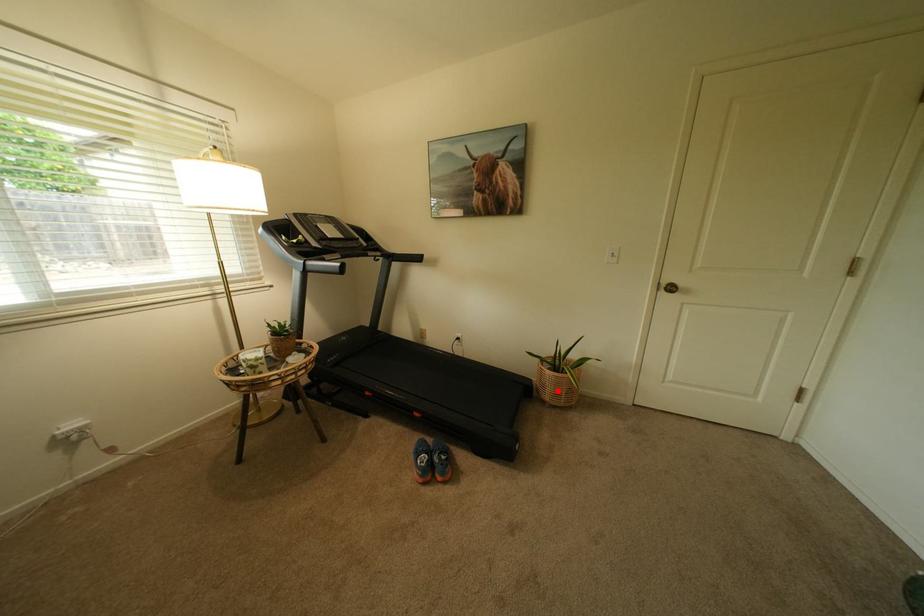
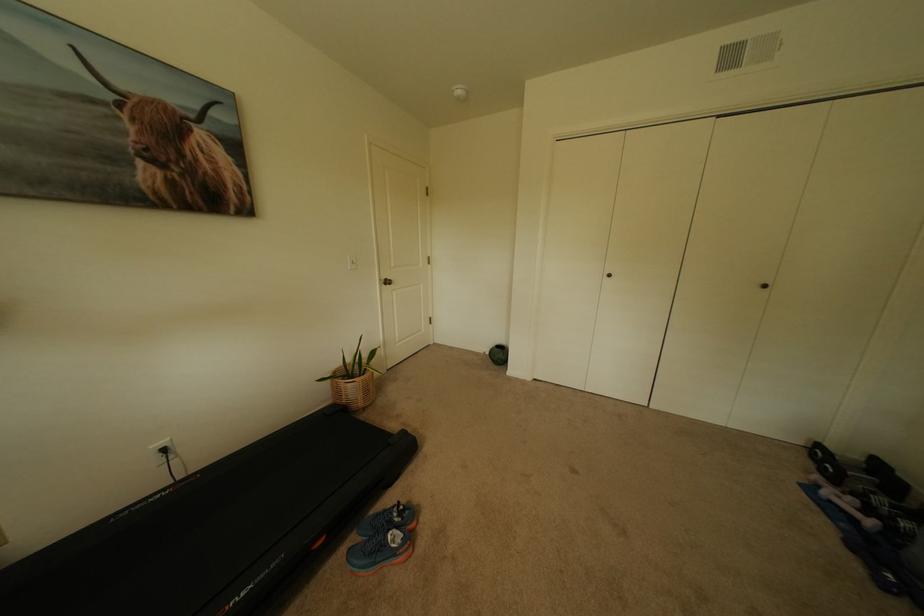
Locate, in the second image, the point that corresponds to the highlighted location in the first image.

(370, 395)